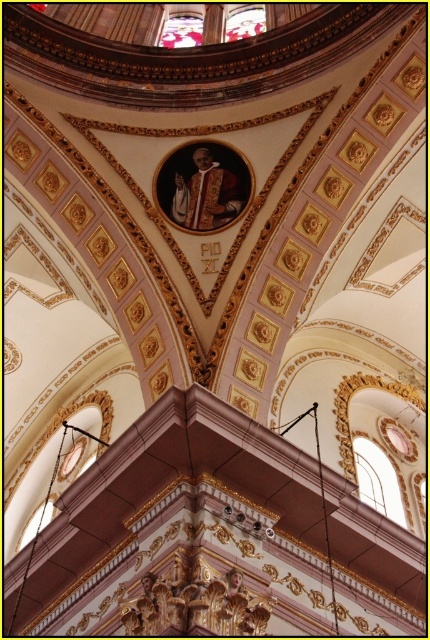
Based on the photo, you are an architect analyzing the church ceiling. You notice two windows at the upper center. Which window is closer to you, the clear glass window at upper center or the transparent glass window at upper center?

The clear glass window at upper center is closer to you because it is in front of the transparent glass window at upper center.

You are an architect designing a new church and want to ensure there is enough space between the transparent glass window at upper center and the transparent stained glass at upper center for a decorative column. The column requires a minimum of 4 meters of space between them. Based on the image, will this be possible?

The transparent glass window at upper center is 4.38 meters from transparent stained glass at upper center, which exceeds the required 4 meters, so the decorative column can be placed between them.